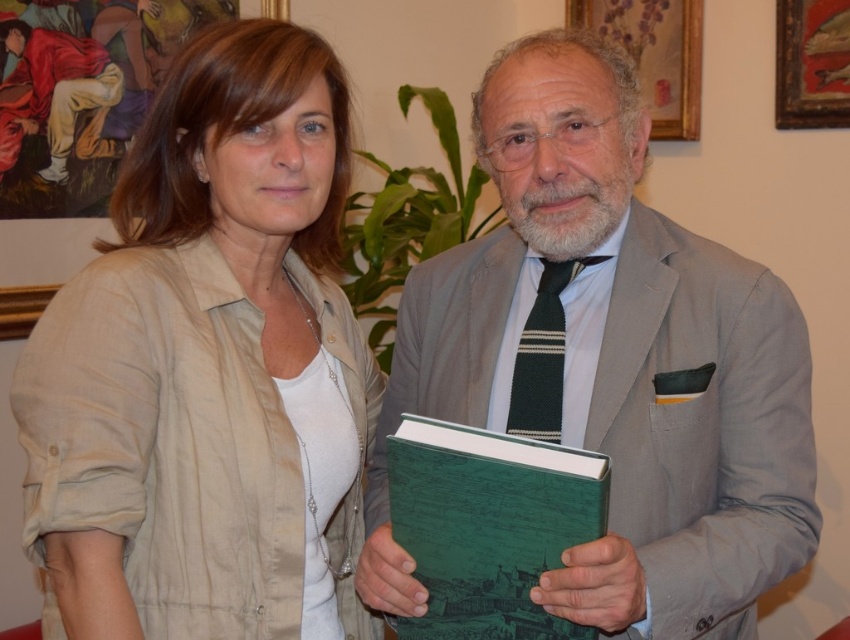
Question: Does green knitted tie at center appear under wooden frame at upper right?

Choices:
 (A) yes
 (B) no

Answer: (A)

Question: Does beige linen shirt at left appear over matte beige shirt at upper left?

Choices:
 (A) no
 (B) yes

Answer: (A)

Question: Which point is closer to the camera taking this photo?

Choices:
 (A) (809, 32)
 (B) (693, 33)
 (C) (476, 593)

Answer: (C)

Question: Which point is farther to the camera?

Choices:
 (A) (740, 328)
 (B) (401, 500)
 (C) (348, 321)
 (D) (3, 304)

Answer: (D)

Question: Which object appears closest to the camera in this image?

Choices:
 (A) wooden frame at upper right
 (B) gray wool suit at center

Answer: (B)

Question: From the image, what is the correct spatial relationship of beige linen shirt at left in relation to wooden frame at upper right?

Choices:
 (A) below
 (B) above

Answer: (A)